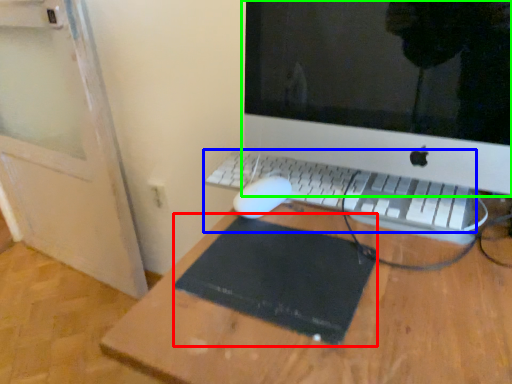
Question: Which is nearer to the mousepad (highlighted by a red box)? computer keyboard (highlighted by a blue box) or computer monitor (highlighted by a green box).

Choices:
 (A) computer keyboard
 (B) computer monitor

Answer: (A)